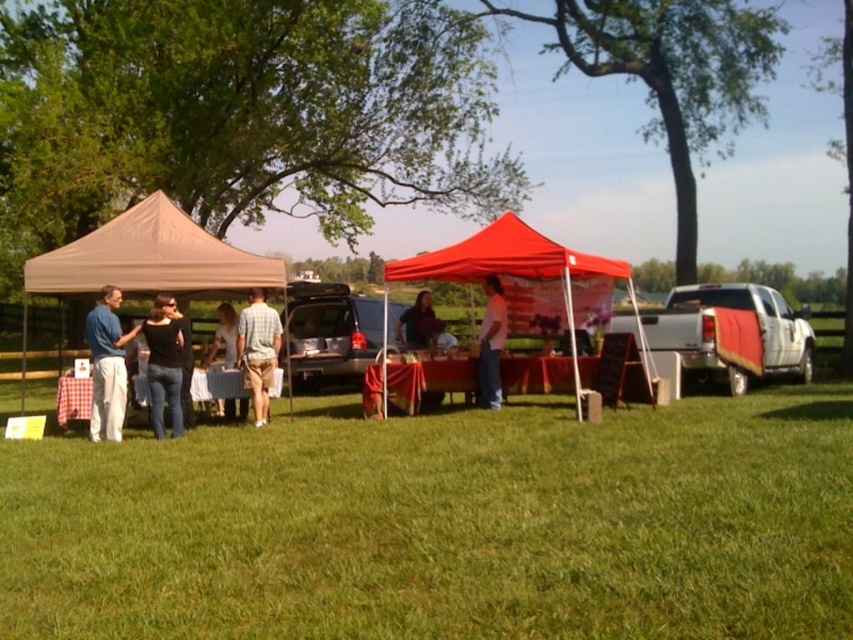
You are standing in the middle of the green grass at lower center and want to pick up the dark brown leather jacket at center. Is the jacket within your immediate reach without moving your feet?

The green grass at lower center is closer to the viewer than dark brown leather jacket at center, so the jacket is further away. You would need to move your feet to reach it.

From the picture: You are standing at the entrance of the beige tent and want to find the black matte shirt at center. Based on the coordinates provided, in which direction should you move to locate it?

The black matte shirt at center is located at coordinates point (x=164, y=364), so you should move towards the center of the image to find it.